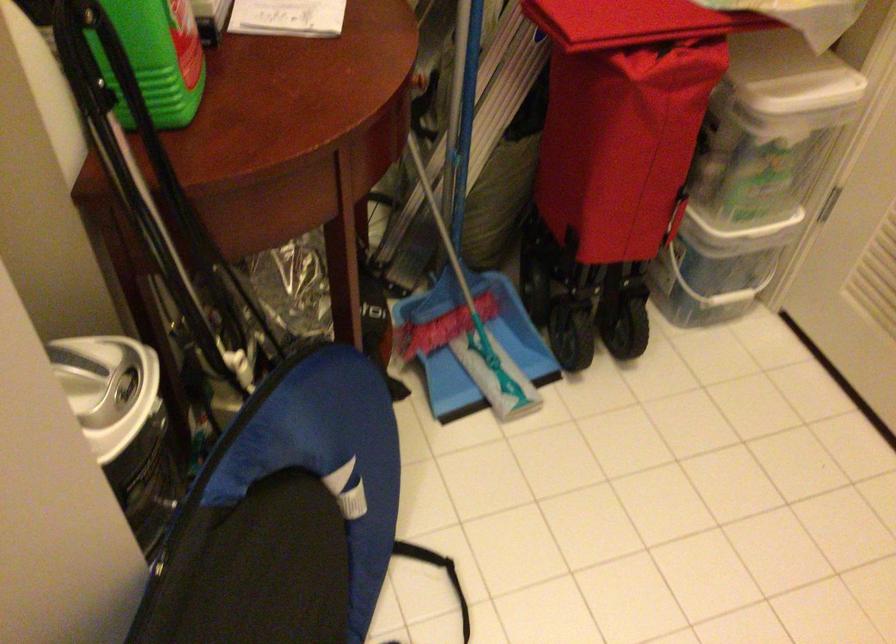
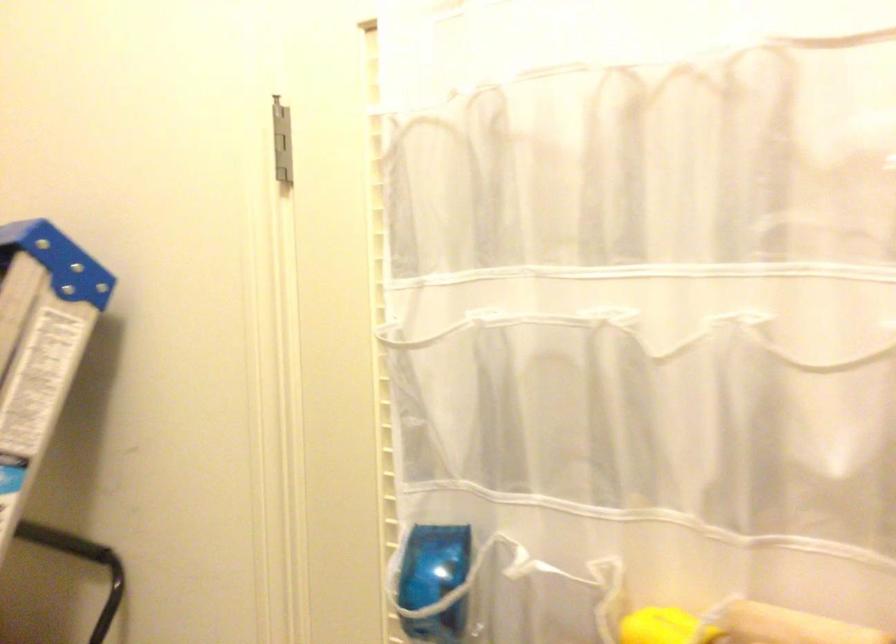
The first image is from the beginning of the video and the second image is from the end. How did the camera likely rotate when shooting the video?

The camera's rotation is toward right-up.